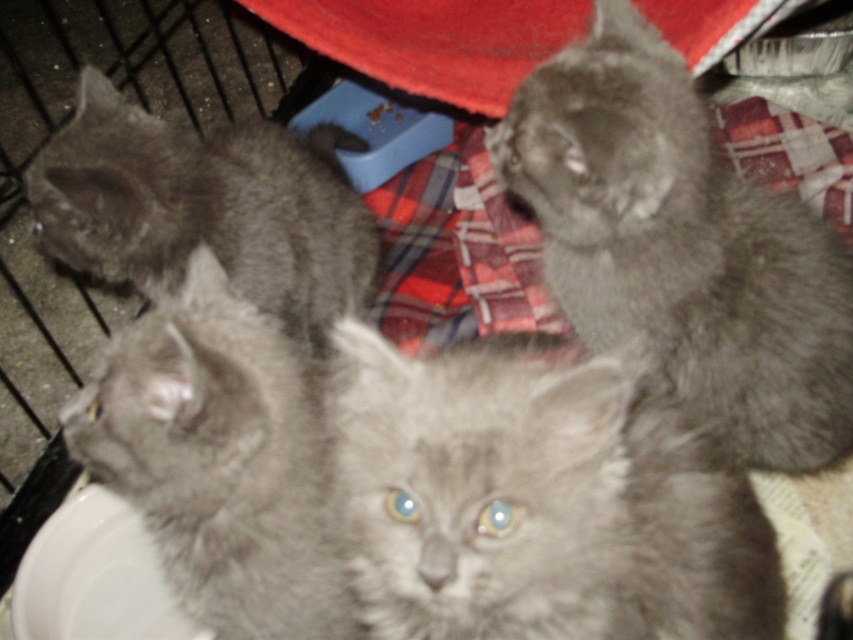
Can you confirm if fluffy gray cat at upper right is thinner than white glossy plate at lower left?

No, fluffy gray cat at upper right is not thinner than white glossy plate at lower left.

Is point (711, 340) less distant than point (143, 634)?

Yes, point (711, 340) is closer to viewer.

Which is behind, point (737, 193) or point (91, 499)?

The point (91, 499) is behind.

Where is `fluffy gray cat at upper right`? The image size is (853, 640). fluffy gray cat at upper right is located at coordinates coord(682,243).

Does gray fluffy cat at left have a greater height compared to white glossy plate at lower left?

Indeed, gray fluffy cat at left has a greater height compared to white glossy plate at lower left.

What do you see at coordinates (206, 208) in the screenshot?
I see `gray fluffy cat at left` at bounding box center [206, 208].

Find the location of `gray fluffy cat at left`. gray fluffy cat at left is located at coordinates (206, 208).

Does fluffy gray kitten at center have a lesser width compared to gray fluffy cat at left?

In fact, fluffy gray kitten at center might be wider than gray fluffy cat at left.

Find the location of a particular element. Image resolution: width=853 pixels, height=640 pixels. fluffy gray kitten at center is located at coordinates (538, 499).

What do you see at coordinates (538, 499) in the screenshot?
I see `fluffy gray kitten at center` at bounding box center [538, 499].

The image size is (853, 640). Identify the location of fluffy gray kitten at center. (538, 499).